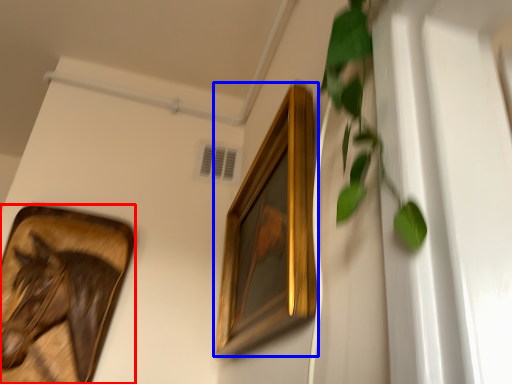
Question: Which of the following is the closest to the observer, picture frame (highlighted by a red box) or picture frame (highlighted by a blue box)?

Choices:
 (A) picture frame
 (B) picture frame

Answer: (B)